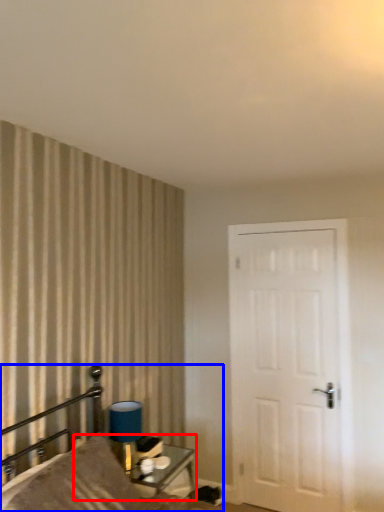
Question: Among these objects, which one is nearest to the camera, table (highlighted by a red box) or bed (highlighted by a blue box)?

Choices:
 (A) table
 (B) bed

Answer: (B)